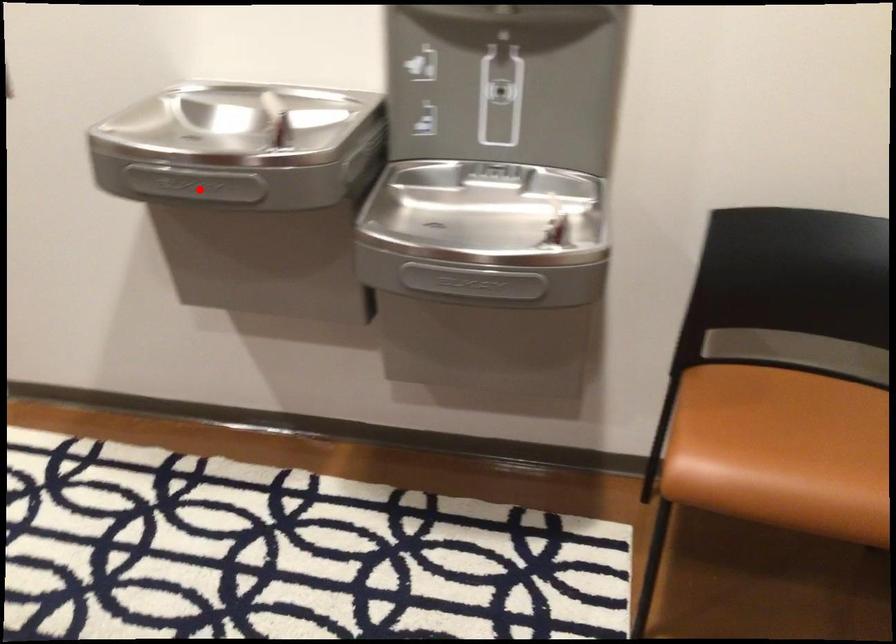
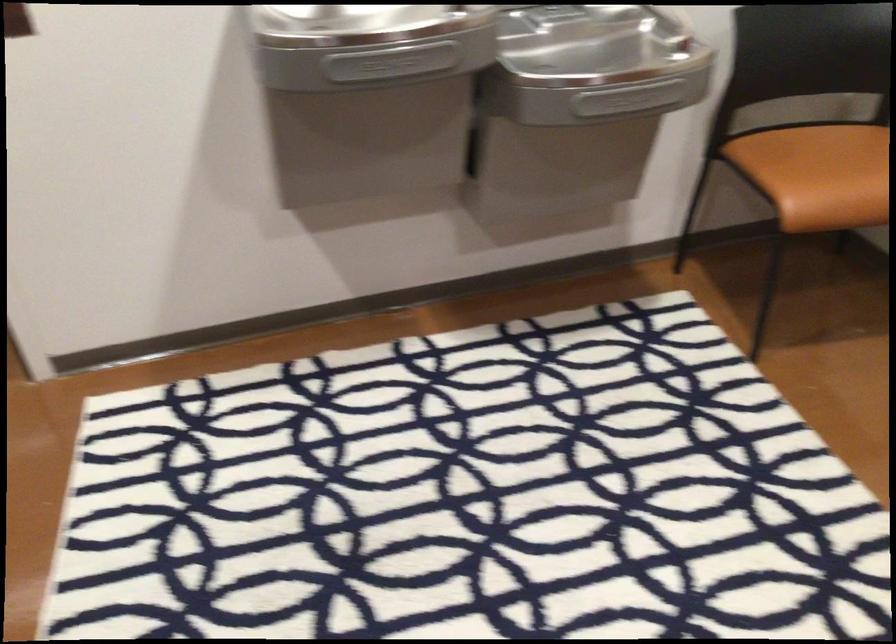
Where in the second image is the point corresponding to the highlighted location from the first image?

(391, 62)